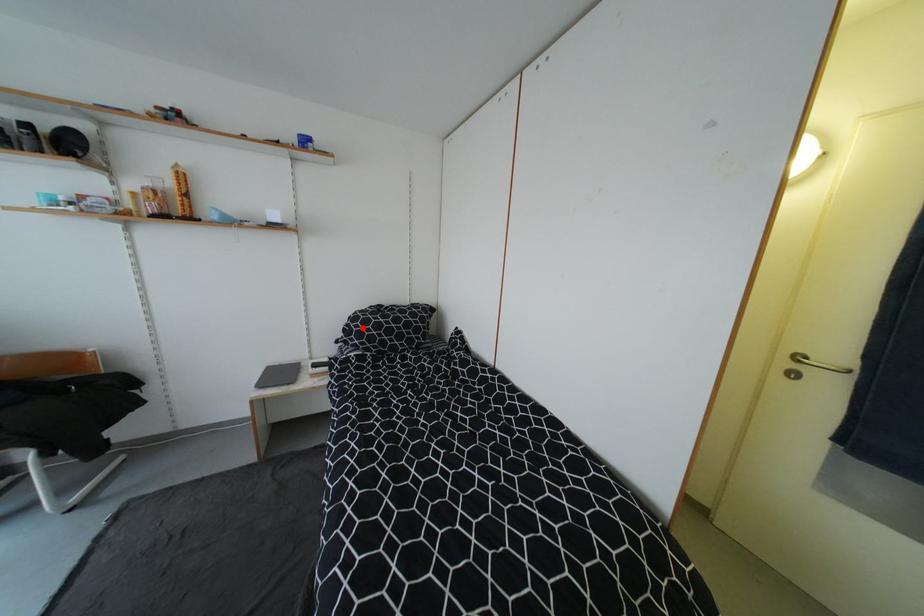
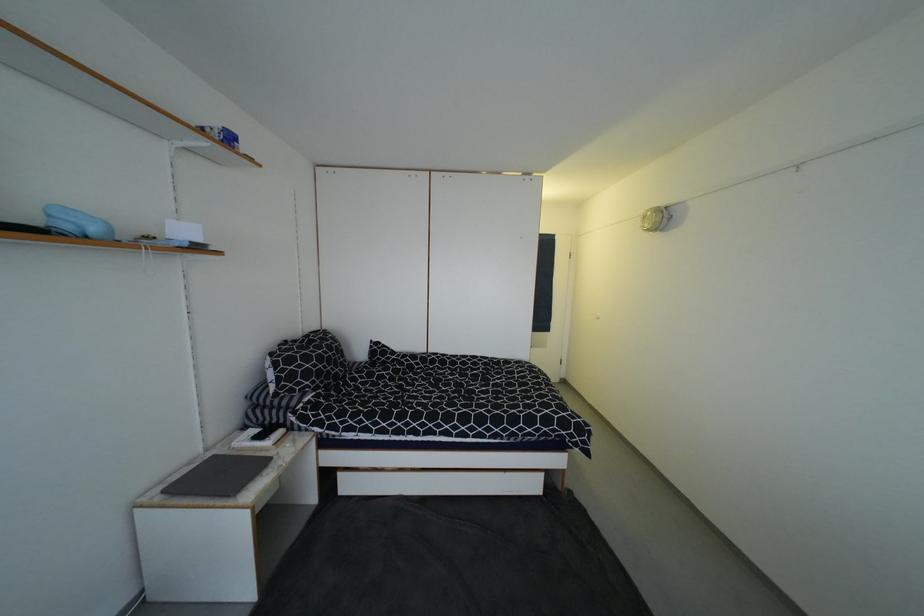
In the second image, find the point that corresponds to the highlighted location in the first image.

(305, 368)